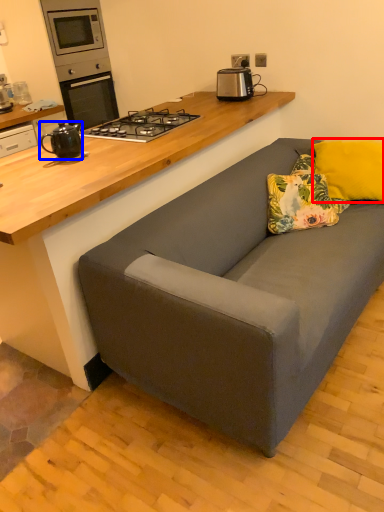
Question: Which object is further to the camera taking this photo, pillow (highlighted by a red box) or kitchen appliance (highlighted by a blue box)?

Choices:
 (A) pillow
 (B) kitchen appliance

Answer: (A)